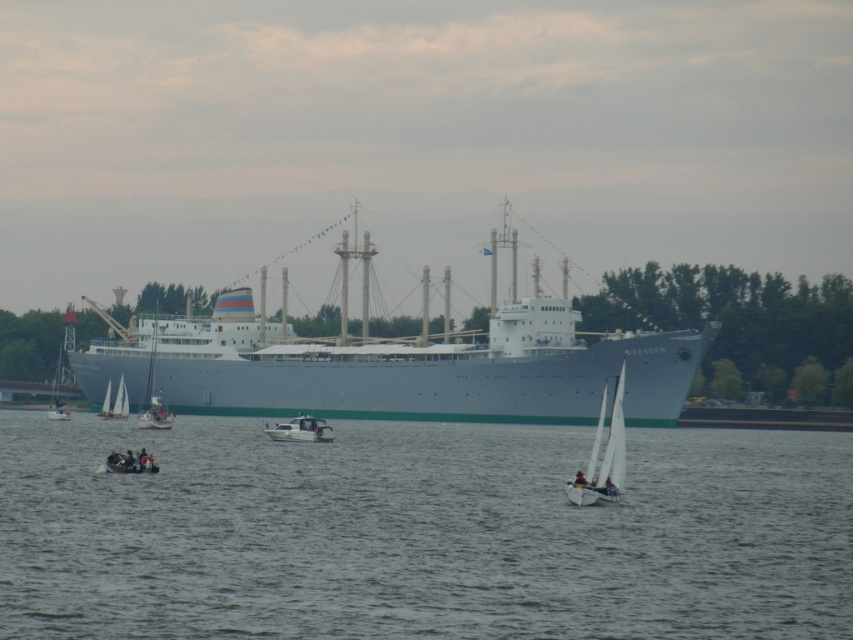
Is the position of gray water at center less distant than that of white matte boat at center?

That is True.

Can you confirm if gray water at center is positioned to the right of white matte boat at center?

Indeed, gray water at center is positioned on the right side of white matte boat at center.

Who is more distant from viewer, (535,611) or (280,435)?

Positioned behind is point (280,435).

Image resolution: width=853 pixels, height=640 pixels. Identify the location of gray water at center. (419, 532).

Looking at this image, between gray water at center and white sailboat at left, which one is positioned lower?

gray water at center is below.

At what (x,y) coordinates should I click in order to perform the action: click on gray water at center. Please return your answer as a coordinate pair (x, y). Looking at the image, I should click on (419, 532).

What are the coordinates of `gray water at center` in the screenshot? It's located at (419, 532).

Can you confirm if gray water at center is wider than white plastic boat at lower left?

Indeed, gray water at center has a greater width compared to white plastic boat at lower left.

Is gray water at center to the right of white plastic boat at lower left from the viewer's perspective?

Indeed, gray water at center is positioned on the right side of white plastic boat at lower left.

This screenshot has height=640, width=853. Identify the location of gray water at center. click(x=419, y=532).